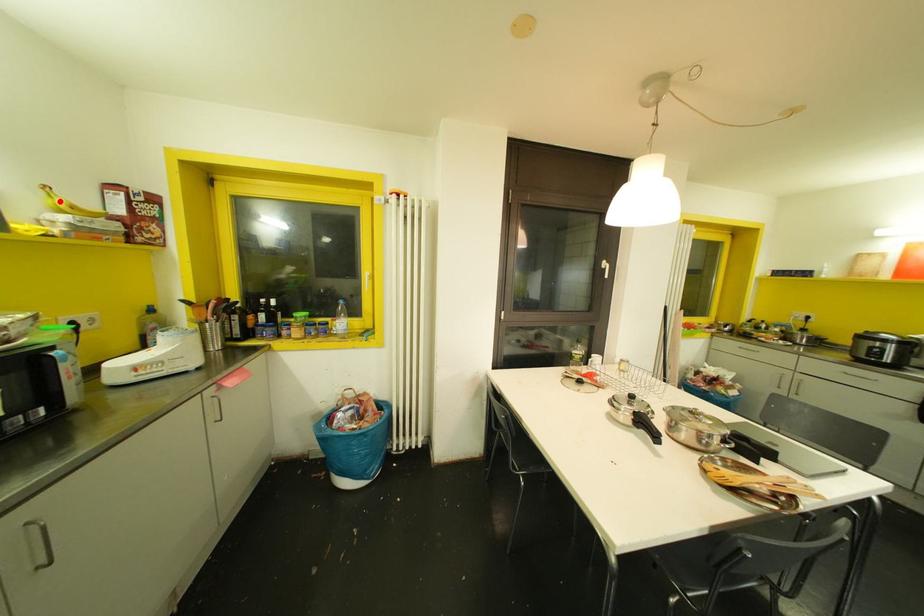
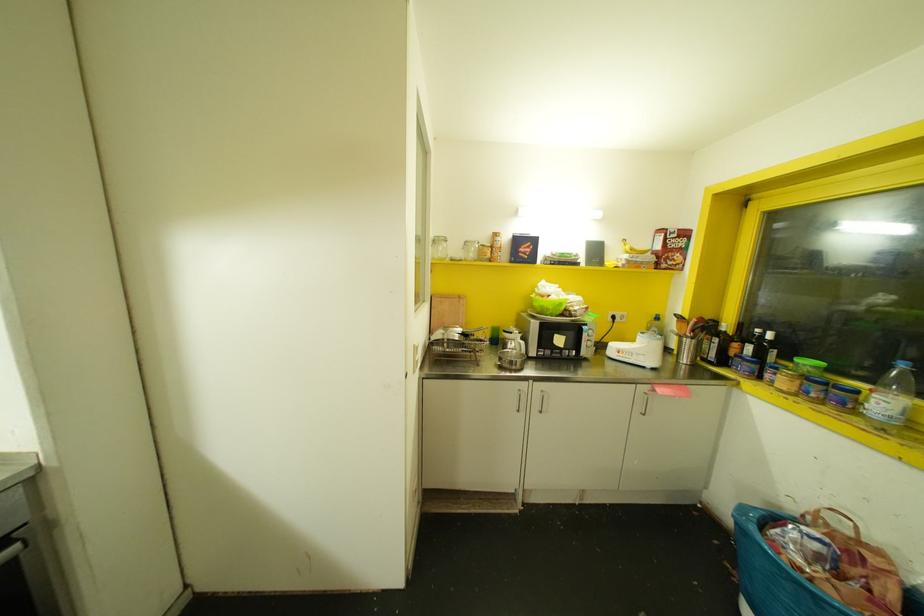
Locate, in the second image, the point that corresponds to the highlighted location in the first image.

(626, 246)